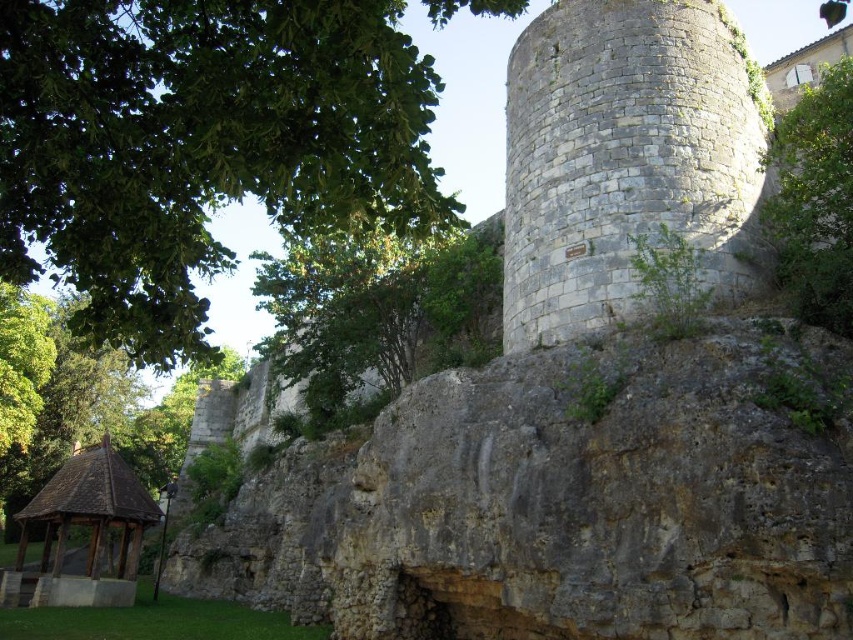
You are standing at the base of the gray stone tower at upper right and want to walk to the green leafy tree at upper center. Which direction should you head to reach the tree?

The gray stone tower at upper right is located above the green leafy tree at upper center, so you should head downward to reach the tree.

You are standing at the grassy area in front of the historic stone wall. You see the gray stone tower at upper right. If you were to draw a straight line from your current position to the tower, what would be the coordinates of the tower relative to your position?

The gray stone tower at upper right is located at coordinates point (624,156) relative to your position.